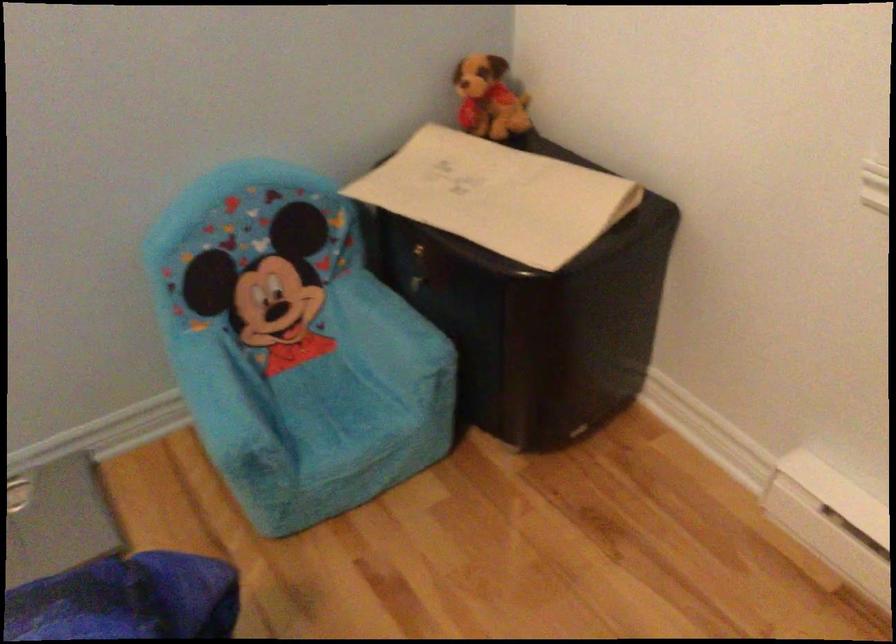
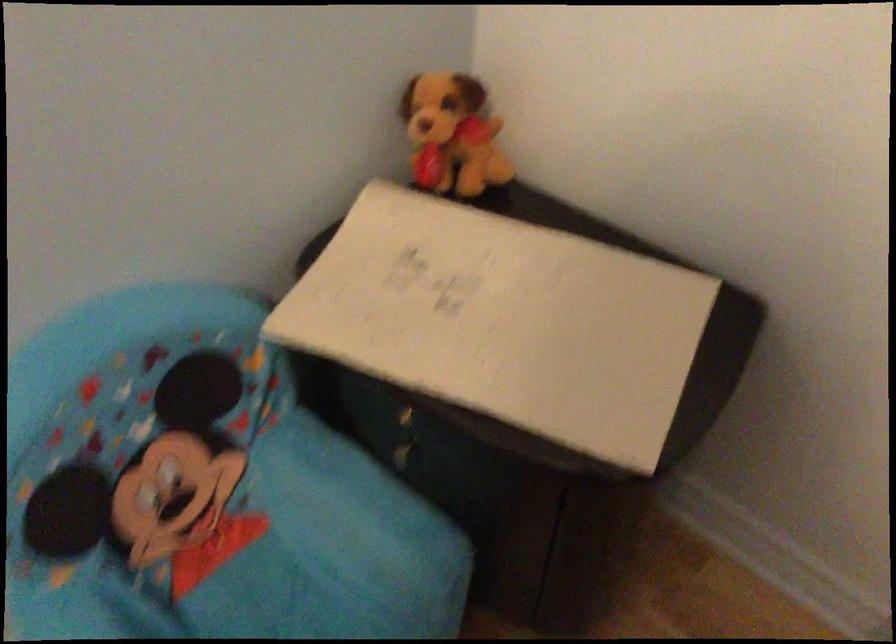
Where in the second image is the point corresponding to (x=503, y=202) from the first image?

(521, 323)